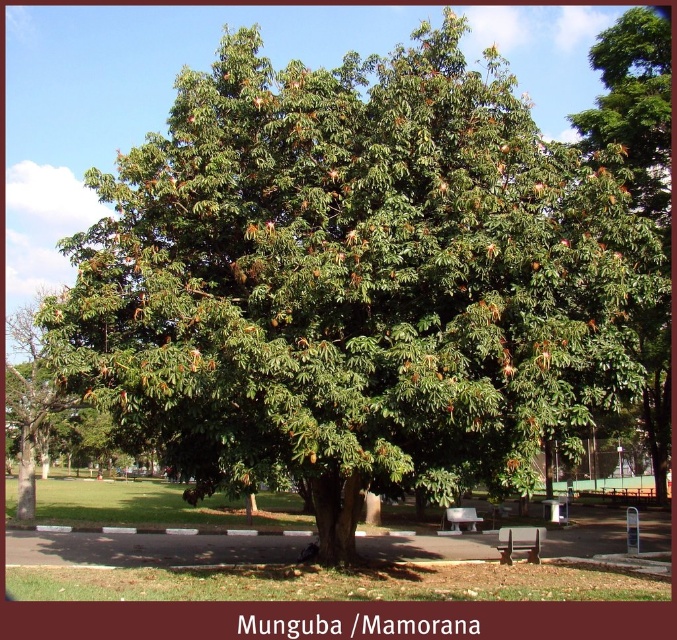
Looking at this image, you are a visitor in the park and want to sit on a bench. There are two options available, the white plastic bench at center and the wooden bench at lower right. Which bench is located to the left of the other?

The white plastic bench at center is positioned on the left side of wooden bench at lower right, so the white plastic bench at center is to the left of the wooden bench at lower right.

You are planning to sit with a group of friends and need a bench that can accommodate 4 people comfortably. Based on the image, which bench between the white plastic bench at center and the wooden bench at lower right would be more suitable?

The white plastic bench at center has a larger width than the wooden bench at lower right, making it more suitable for accommodating 4 people comfortably.